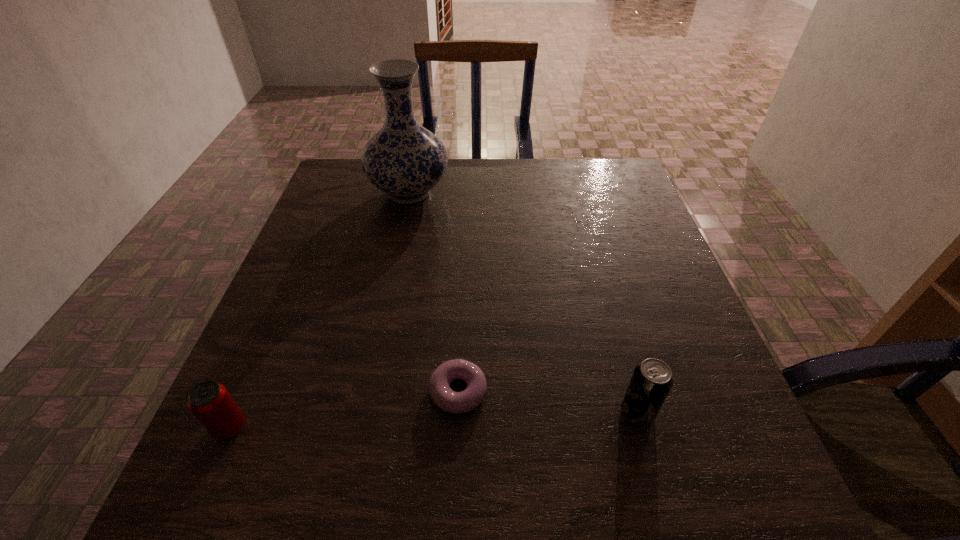
Identify the location of object present at the far edge. (404, 160).

At what (x,y) coordinates should I click in order to perform the action: click on vase that is at the left edge. Please return your answer as a coordinate pair (x, y). Looking at the image, I should click on (404, 160).

You are a GUI agent. You are given a task and a screenshot of the screen. Output one action in this format:
    pyautogui.click(x=<x>, y=<y>)
    Task: Click on the can that is at the left edge
    Image resolution: width=960 pixels, height=540 pixels.
    Given the screenshot: What is the action you would take?
    [x=210, y=402]

The height and width of the screenshot is (540, 960). Find the location of `object that is at the right edge`. object that is at the right edge is located at coordinates (651, 381).

The height and width of the screenshot is (540, 960). I want to click on object that is positioned at the far left corner, so click(x=404, y=160).

You are a GUI agent. You are given a task and a screenshot of the screen. Output one action in this format:
    pyautogui.click(x=<x>, y=<y>)
    Task: Click on the blank area at the far edge
    Image resolution: width=960 pixels, height=540 pixels.
    Given the screenshot: What is the action you would take?
    pyautogui.click(x=555, y=192)

Locate an element on the screen. This screenshot has width=960, height=540. vacant area at the near edge is located at coordinates (635, 483).

Locate an element on the screen. free space at the left edge is located at coordinates (318, 234).

This screenshot has width=960, height=540. Identify the location of vacant space at the right edge of the desktop. (671, 274).

In the image, there is a desktop. Find the location of `vacant space at the far left corner`. vacant space at the far left corner is located at coordinates (332, 181).